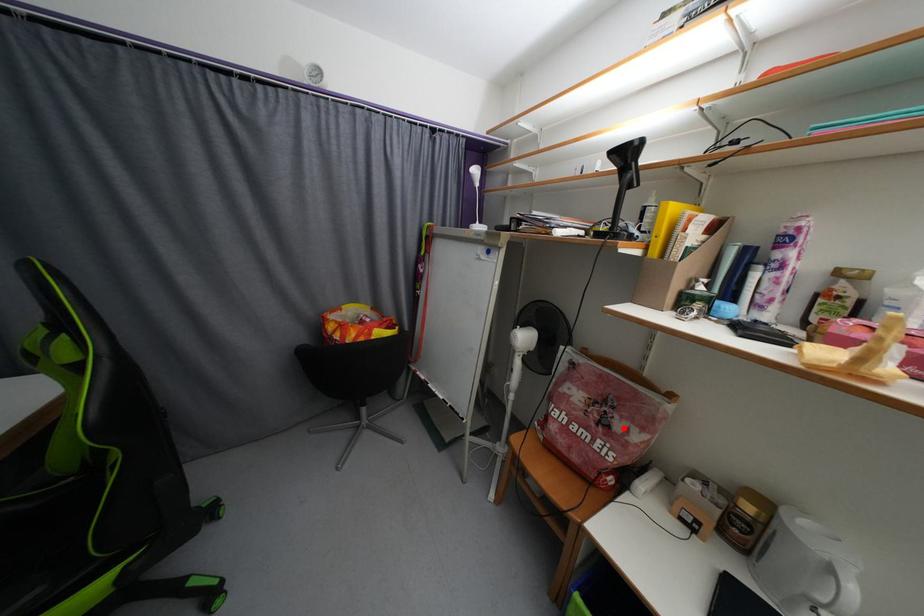
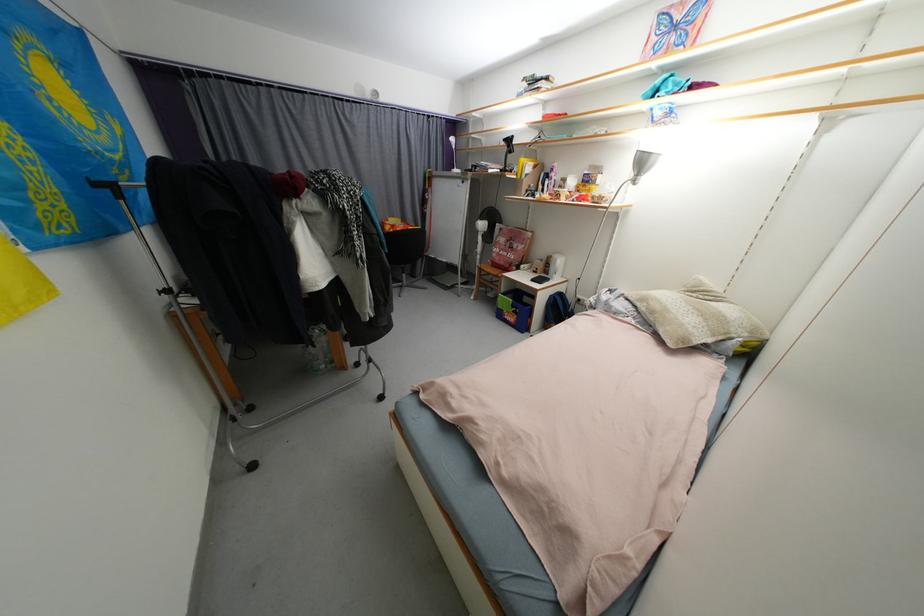
Question: I am providing you with two images of the same scene from different viewpoints. Image1 has a red point marked. In image2, the corresponding 3D location appears at what relative position? Reply with the corresponding letter.

Choices:
 (A) Closer
 (B) Farther

Answer: (A)